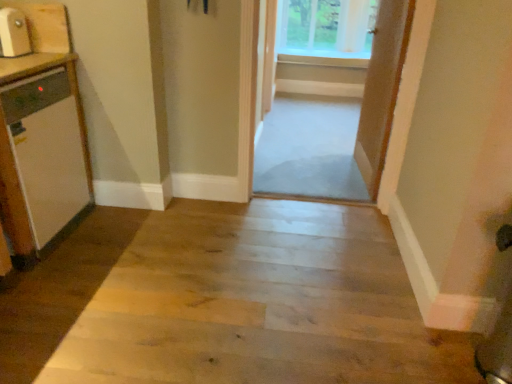
Identify the location of vacant area on the back side of clear glass screen door at center. This screenshot has width=512, height=384. (300, 168).